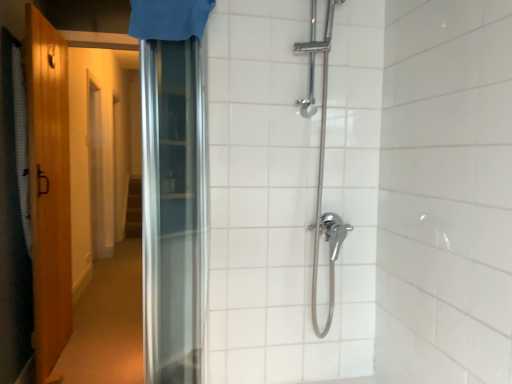
Question: Is white textured shower curtain at left, the first shower curtain when ordered from back to front, taller or shorter than blue fabric shower curtain at upper center, which is the 2th shower curtain from bottom to top?

Choices:
 (A) tall
 (B) short

Answer: (A)

Question: Considering the relative positions of white textured shower curtain at left, the 1th shower curtain positioned from the left, and blue fabric shower curtain at upper center, the 1th shower curtain when ordered from right to left, in the image provided, is white textured shower curtain at left, the 1th shower curtain positioned from the left, to the left or to the right of blue fabric shower curtain at upper center, the 1th shower curtain when ordered from right to left,?

Choices:
 (A) right
 (B) left

Answer: (B)

Question: Considering the real-world distances, which object is closest to the wooden door at left?

Choices:
 (A) blue fabric shower curtain at upper center, the 2th shower curtain positioned from the left
 (B) white textured shower curtain at left, the 1th shower curtain positioned from the left

Answer: (B)

Question: Which is nearer to the blue fabric shower curtain at upper center, which is the 2th shower curtain in back-to-front order?

Choices:
 (A) wooden door at left
 (B) white textured shower curtain at left, acting as the 1th shower curtain starting from the bottom

Answer: (B)